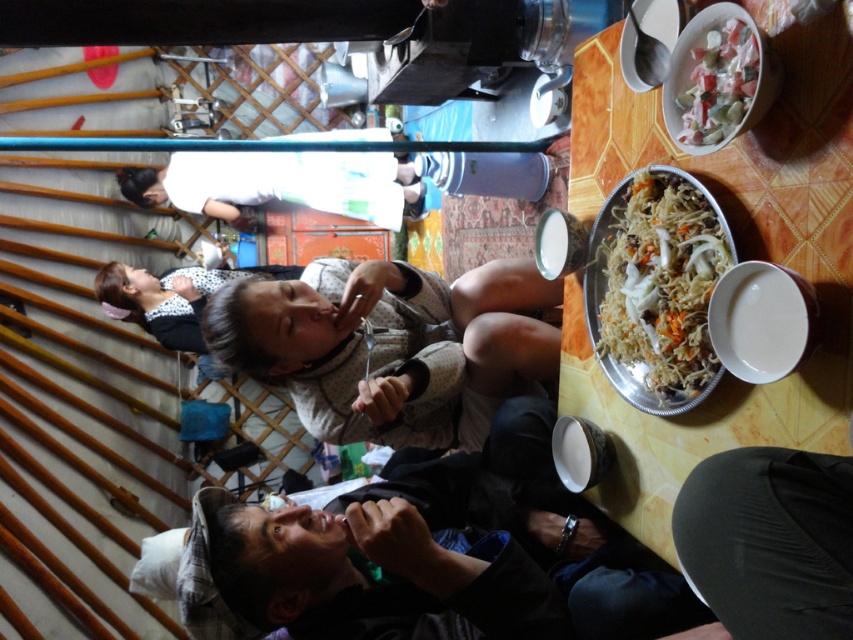
You are standing at the entrance of the yurt and want to place a tray on the wooden table at right. According to the coordinates provided, where exactly should you aim to place it?

The wooden table at right is located at coordinates point (738, 259), so you should aim for that exact point to place the tray.

From the picture: You are planning to place a rectangular tray that is 1 meter long onto the wooden table at right and the white rice pilaf at upper right. Which object can the tray fit on?

The wooden table at right has a larger width than the white rice pilaf at upper right, so the rectangular tray that is 1 meter long can fit on the wooden table at right.